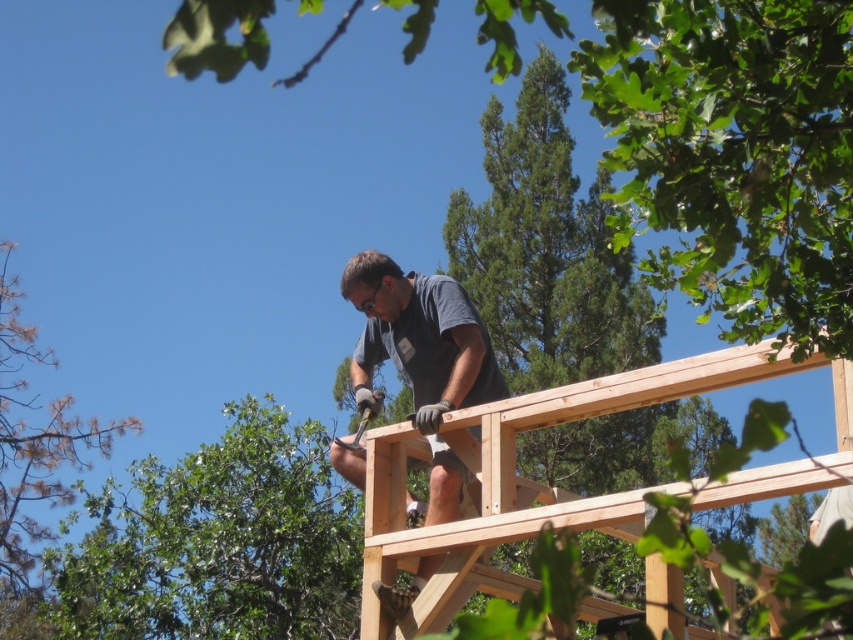
You are a safety inspector observing the construction site. You notice the dark gray shirt at center and the brown wood tree at left. Which object appears larger in the image?

The brown wood tree at left appears larger than the dark gray shirt at center in the image.

You are a safety inspector observing the construction site shown in the image. You notice the dark gray shirt at center and the brown wood tree at left. Based on the spatial relationship between these two objects, can you determine if the worker is facing towards or away from the tree?

The dark gray shirt at center is in front of the brown wood tree at left, which means the worker is facing away from the tree since the shirt is between the observer and the tree.